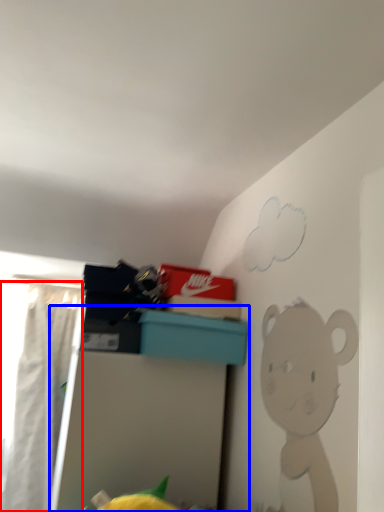
Question: Which of the following is the closest to the observer, curtain (highlighted by a red box) or furniture (highlighted by a blue box)?

Choices:
 (A) curtain
 (B) furniture

Answer: (B)